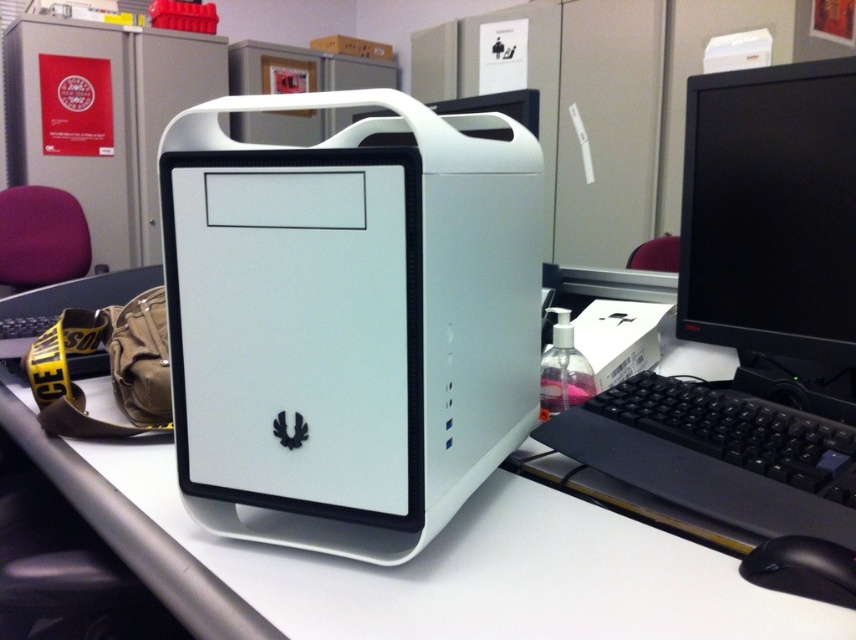
Between point (528, 192) and point (785, 292), which one is positioned behind?

Point (785, 292)

Who is positioned more to the right, white plastic computer at center or black glossy monitor at right?

black glossy monitor at right is more to the right.

Between point (372, 522) and point (811, 168), which one is positioned behind?

Positioned behind is point (811, 168).

Find the location of a particular element. This screenshot has width=856, height=640. white plastic computer at center is located at coordinates (348, 321).

Looking at this image, who is more distant from viewer, [756,442] or [834,602]?

Point [756,442]

Locate an element on the screen. This screenshot has height=640, width=856. black plastic keyboard at center is located at coordinates (x=717, y=456).

Locate an element on the screen. black plastic keyboard at center is located at coordinates (717, 456).

Which is more to the right, white plastic computer at center or white plastic computer desk at center?

Positioned to the right is white plastic computer at center.

Is white plastic computer at center thinner than white plastic computer desk at center?

Yes, white plastic computer at center is thinner than white plastic computer desk at center.

What do you see at coordinates (348, 321) in the screenshot? I see `white plastic computer at center` at bounding box center [348, 321].

Where is `white plastic computer at center`? The image size is (856, 640). white plastic computer at center is located at coordinates tap(348, 321).